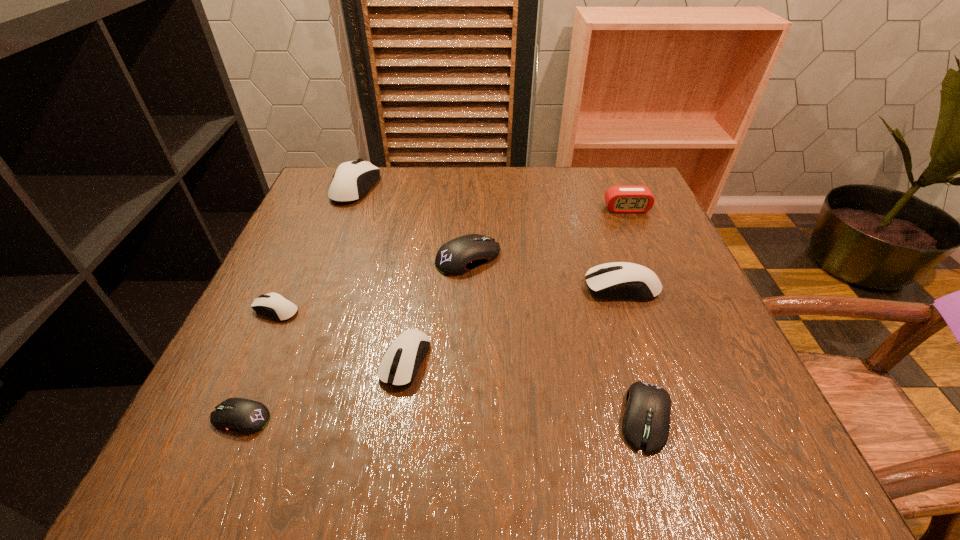
Find the location of a particular element. This screenshot has height=540, width=960. the leftmost black computer equipment is located at coordinates (245, 416).

Where is `vacant area situated 0.210m on the right of the farthest computer equipment`? vacant area situated 0.210m on the right of the farthest computer equipment is located at coordinates coord(458,187).

Find the location of a particular element. The height and width of the screenshot is (540, 960). free location located 0.050m on the front-facing side of the alarm clock is located at coordinates (635, 226).

Locate an element on the screen. This screenshot has height=540, width=960. free space located on the left of the rightmost white mouse is located at coordinates (402, 287).

What are the coordinates of `free space located on the right of the farthest black computer equipment` in the screenshot? It's located at (622, 257).

This screenshot has height=540, width=960. Identify the location of free space located 0.280m on the right of the nearest white mouse. (594, 361).

Where is `vacant position located 0.250m on the left of the second smallest black computer equipment`? This screenshot has height=540, width=960. vacant position located 0.250m on the left of the second smallest black computer equipment is located at coordinates (453, 417).

Locate an element on the screen. The image size is (960, 540). free space located on the right of the smallest white mouse is located at coordinates (421, 309).

Find the location of `free space located 0.270m on the back of the leftmost black computer equipment`. free space located 0.270m on the back of the leftmost black computer equipment is located at coordinates (300, 282).

Where is `mouse located in the far edge section of the desktop`? mouse located in the far edge section of the desktop is located at coordinates (352, 180).